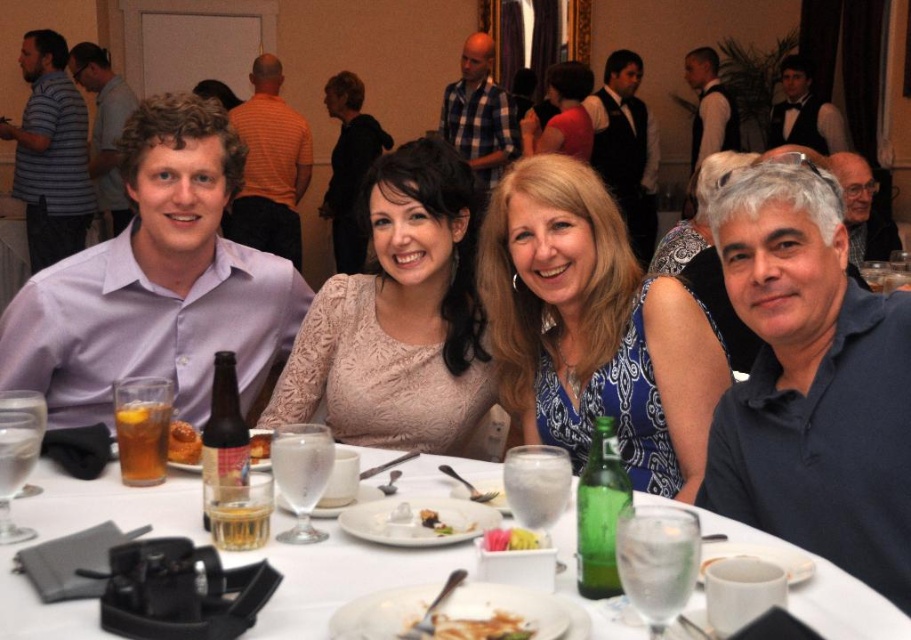
Is green glass bottle at center shorter than white creamy dessert at center?

In fact, green glass bottle at center may be taller than white creamy dessert at center.

Is green glass bottle at center wider than white creamy dessert at center?

No, green glass bottle at center is not wider than white creamy dessert at center.

Where is `green glass bottle at center`? green glass bottle at center is located at coordinates (600, 513).

Between gray fabric shirt at upper right and golden crispy fries at center, which one has less height?

golden crispy fries at center

Which is behind, point (855, 157) or point (487, 628)?

The point (855, 157) is behind.

Which is in front, point (861, 204) or point (425, 632)?

Positioned in front is point (425, 632).

Where is `gray fabric shirt at upper right`? The height and width of the screenshot is (640, 911). gray fabric shirt at upper right is located at coordinates (x=862, y=209).

Does golden crispy fries at center have a greater height compared to bread doughnut at center?

In fact, golden crispy fries at center may be shorter than bread doughnut at center.

Who is shorter, golden crispy fries at center or bread doughnut at center?

With less height is golden crispy fries at center.

Does point (456, 627) lie behind point (254, 448)?

No, (456, 627) is in front of (254, 448).

I want to click on golden crispy fries at center, so click(471, 627).